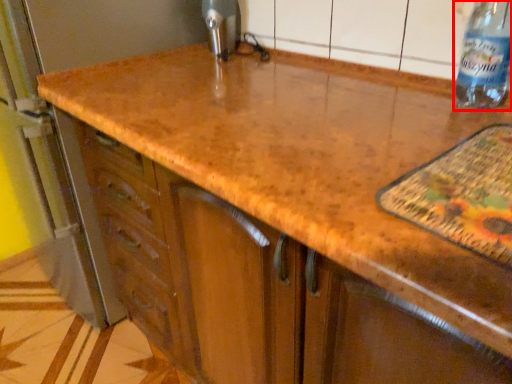
Question: From the image's perspective, what is the correct spatial relationship of bottle (annotated by the red box) in relation to appliance?

Choices:
 (A) below
 (B) above

Answer: (A)